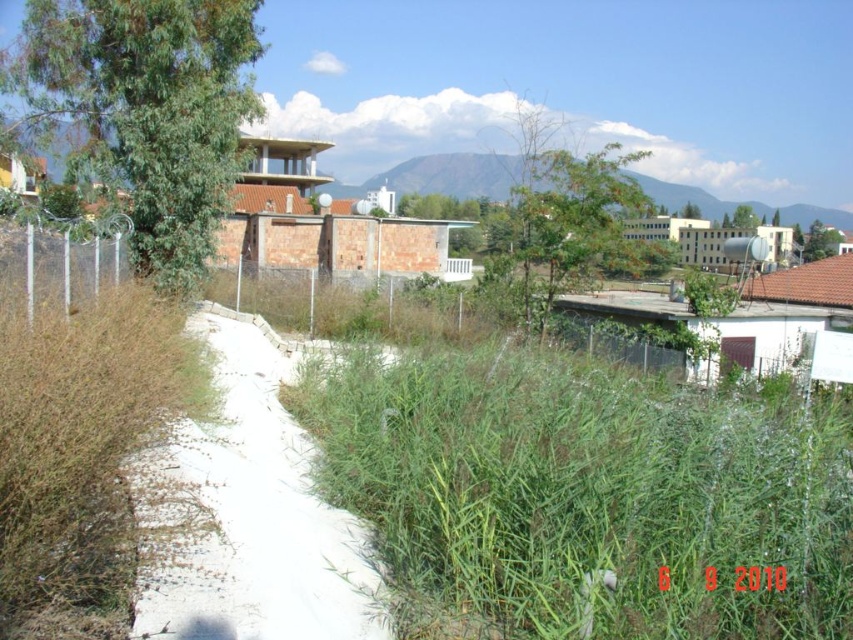
You are a gardener who wants to plant flowers in the green grass at center and green grassy hillside at upper center. Which area has a thicker layer of grass to better support the flowers?

The green grassy hillside at upper center has a thicker layer of grass than the green grass at center, so it would better support the flowers.

You are a gardener trying to mow the green grass at center. You are currently standing on the white concrete path at center. In which direction should you move to reach the grass?

The green grass at center is below the white concrete path at center, so you should move downward from the white concrete path at center to reach the green grass at center.